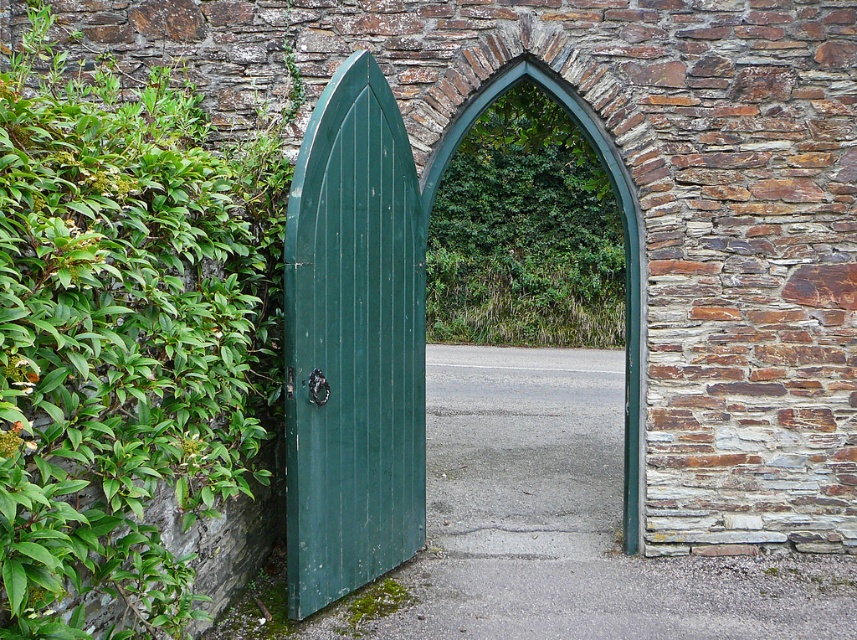
From the picture: How far apart are green wooden door at center and green leafy vegetation at center?

A distance of 9.57 feet exists between green wooden door at center and green leafy vegetation at center.

Describe the element at coordinates (352, 342) in the screenshot. I see `green wooden door at center` at that location.

Where is `green wooden door at center`? This screenshot has width=857, height=640. green wooden door at center is located at coordinates pyautogui.click(x=352, y=342).

Identify the location of green wooden door at center. (352, 342).